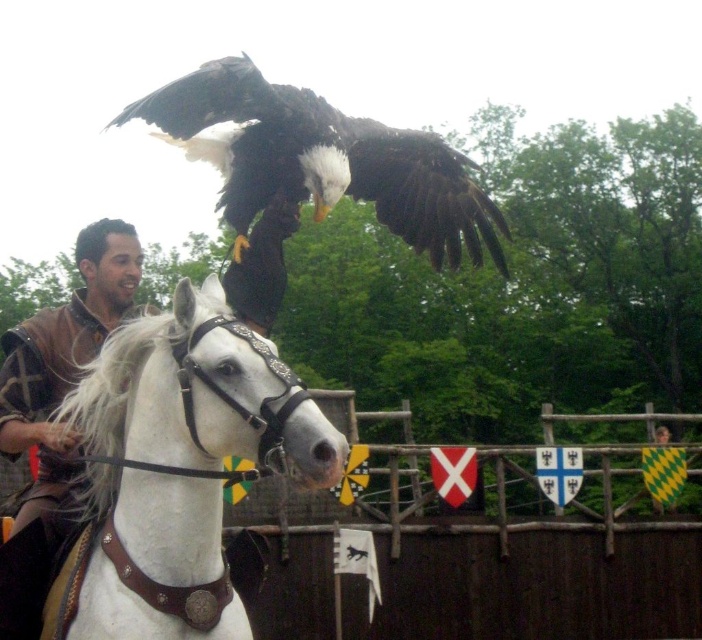
You are a photographer at the medieval event. You need to capture a photo where both the white leather horse at center and the dark brown feathers at center are visible. Considering their sizes, which object will appear larger in the photo?

The white leather horse at center will appear larger in the photo because it is taller than the dark brown feathers at center.

You are a photographer standing at a safe distance from the white leather horse at center. You want to capture a closeup shot of the horse without getting too close. Your camera has a zoom lens with a maximum zoom range of 10x. Knowing that the horse is 8.80 feet away, can you estimate if your camera can zoom in enough to get a clear closeup of the horse?

The white leather horse at center is 8.80 feet away from the viewer. A 10x zoom lens can effectively magnify subjects at this distance, allowing for a clear closeup shot without needing to approach closer than 8.80 feet.

From the picture: You are a painter observing the scene. You need to sketch the white leather horse at center and the dark brown feathers at center. Which object should you draw first if you want to focus on the wider one?

The dark brown feathers at center are wider than the white leather horse at center, so you should draw the dark brown feathers at center first to focus on the wider one.